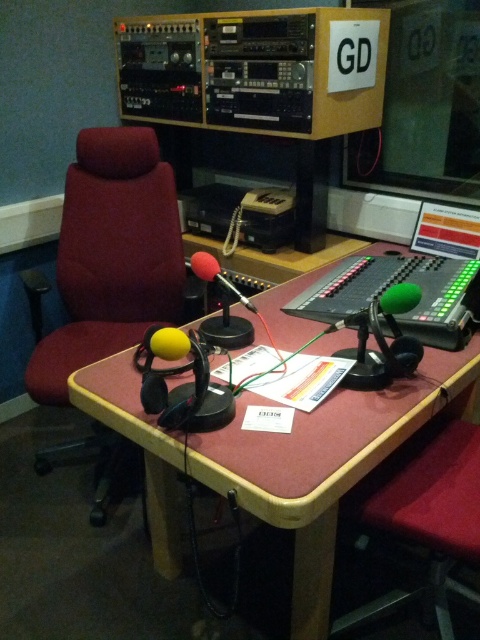
Does velvet red swivel chair at left appear under wooden desk at center?

No, velvet red swivel chair at left is not below wooden desk at center.

The height and width of the screenshot is (640, 480). Describe the element at coordinates (110, 256) in the screenshot. I see `velvet red swivel chair at left` at that location.

Locate an element on the screen. The width and height of the screenshot is (480, 640). velvet red swivel chair at left is located at coordinates (110, 256).

The image size is (480, 640). Describe the element at coordinates (110, 256) in the screenshot. I see `velvet red swivel chair at left` at that location.

Between velvet red swivel chair at left and rubberized red microphone at center, which one appears on the right side from the viewer's perspective?

rubberized red microphone at center

Is point (26, 388) positioned in front of point (201, 260)?

No, (26, 388) is further to viewer.

Identify the location of velvet red swivel chair at left. The height and width of the screenshot is (640, 480). (110, 256).

Does point (475, 388) lie behind point (205, 269)?

Yes, it is behind point (205, 269).

Between wooden desk at center and rubberized red microphone at center, which one appears on the right side from the viewer's perspective?

wooden desk at center is more to the right.

Who is more distant from viewer, (343, 467) or (233, 284)?

The point (233, 284) is behind.

I want to click on wooden desk at center, so click(x=332, y=502).